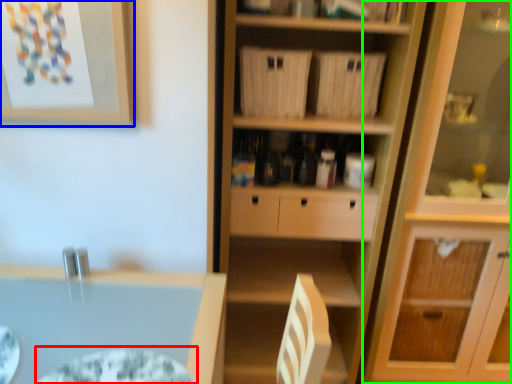
Question: Which object is positioned farthest from glass plate (highlighted by a red box)? Select from picture frame (highlighted by a blue box) and cabinetry (highlighted by a green box).

Choices:
 (A) picture frame
 (B) cabinetry

Answer: (B)